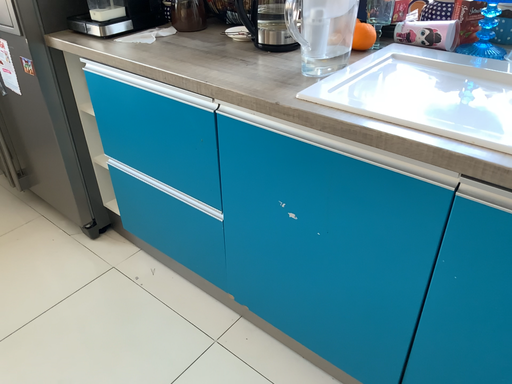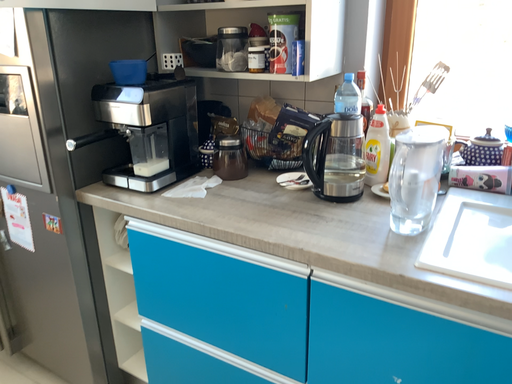
Question: Which way did the camera rotate in the video?

Choices:
 (A) rotated left
 (B) rotated right

Answer: (B)